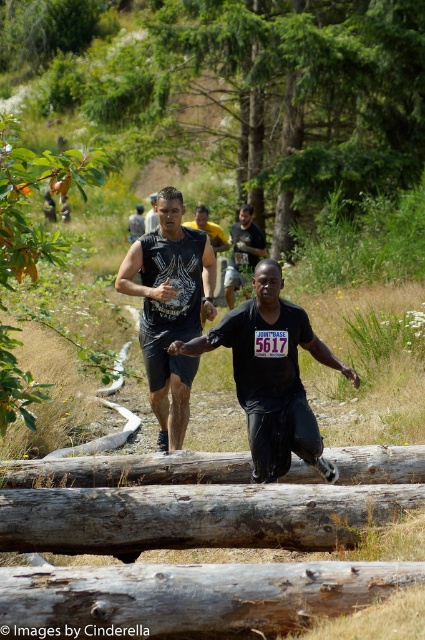
Question: Is weathered brown log at center to the right of brown rough log at center from the viewer's perspective?

Choices:
 (A) yes
 (B) no

Answer: (A)

Question: Which of the following is the farthest from the observer?

Choices:
 (A) black matte shirt at center
 (B) weathered brown log at center
 (C) black matte t-shirt at center
 (D) black matte tank top at center

Answer: (C)

Question: Which of the following is the closest to the observer?

Choices:
 (A) weathered brown log at center
 (B) brown rough log at lower center
 (C) black matte tank top at center

Answer: (A)

Question: Is brown rough log at lower center positioned at the back of black matte shirt at center?

Choices:
 (A) yes
 (B) no

Answer: (B)

Question: Does brown rough log at lower center come behind brown rough log at center?

Choices:
 (A) yes
 (B) no

Answer: (B)

Question: Among these objects, which one is farthest from the camera?

Choices:
 (A) weathered brown log at center
 (B) brown rough log at lower center
 (C) black matte shirt at center

Answer: (C)